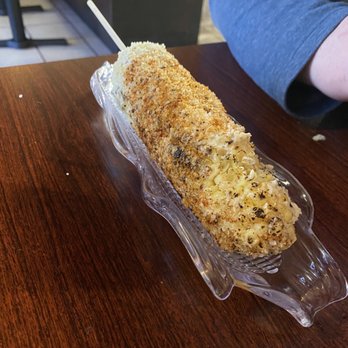
At what (x,y) coordinates should I click in order to perform the action: click on black wall section center top. Please return your answer as a coordinate pair (x, y). The image size is (348, 348). Looking at the image, I should click on (175, 21), (139, 13).